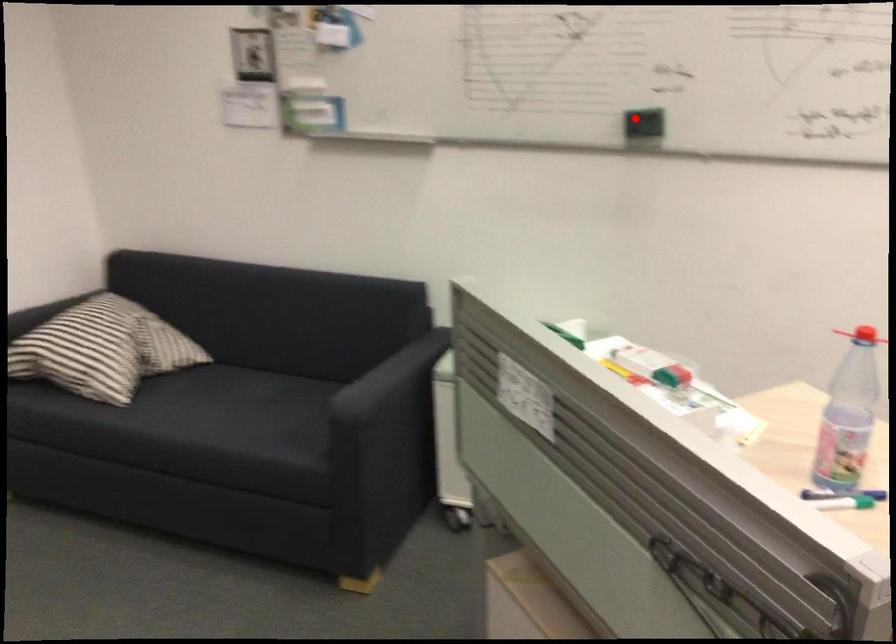
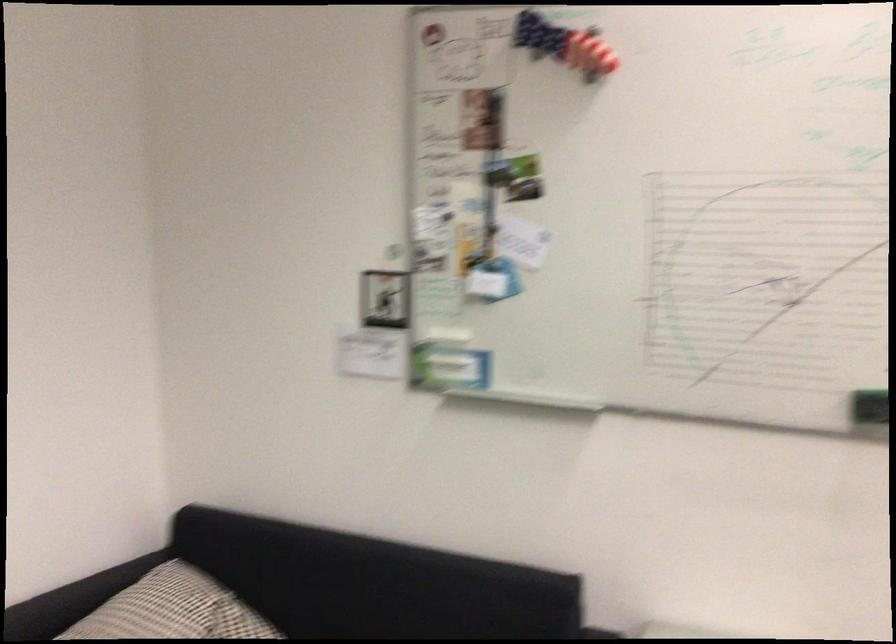
The point at the highlighted location is marked in the first image. Where is the corresponding point in the second image?

(869, 406)